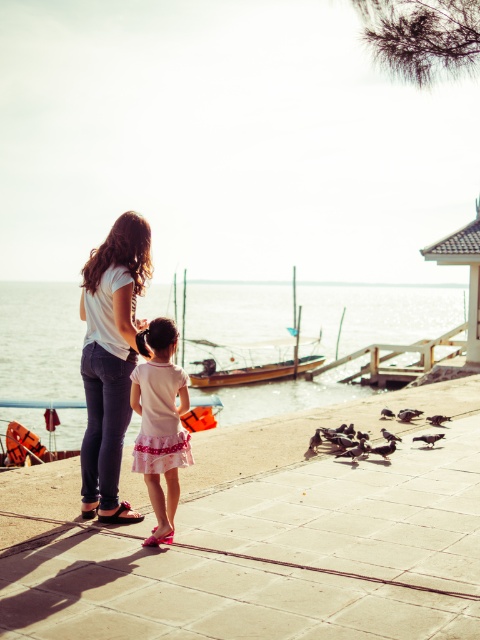
Question: Can you confirm if wooden boat at center is wider than dark brown feathers at center?

Choices:
 (A) yes
 (B) no

Answer: (A)

Question: Which point is closer to the camera?

Choices:
 (A) brown feathered bird at lower center
 (B) clear water at lower center
 (C) matte black sandal at lower left

Answer: (C)

Question: Considering the real-world distances, which object is farthest from the smooth concrete dock at center?

Choices:
 (A) brown feathered bird at lower center
 (B) orange fabric sandal at lower left
 (C) dark brown feathers at center

Answer: (C)

Question: Which point appears farthest from the camera in this image?

Choices:
 (A) (429, 419)
 (B) (83, 512)
 (C) (212, 330)

Answer: (C)

Question: Can you confirm if matte black sandal at lower left is bigger than brown feathered bird at lower center?

Choices:
 (A) yes
 (B) no

Answer: (B)

Question: From the image, what is the correct spatial relationship of wooden boat at center in relation to pink fabric sandal at lower center?

Choices:
 (A) below
 (B) above

Answer: (B)